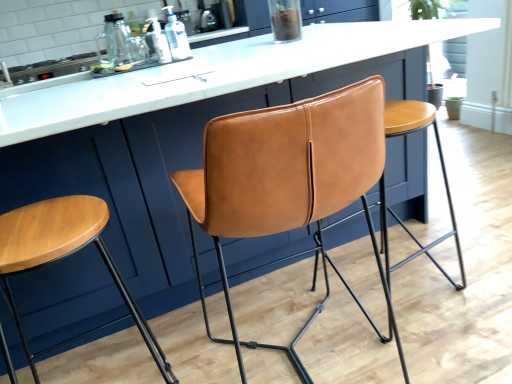
Where is `vacant area that lies between cognac leather chair at center and matte leather stool at center, the 2th stool in the left-to-right sequence`? The height and width of the screenshot is (384, 512). vacant area that lies between cognac leather chair at center and matte leather stool at center, the 2th stool in the left-to-right sequence is located at coordinates (405, 333).